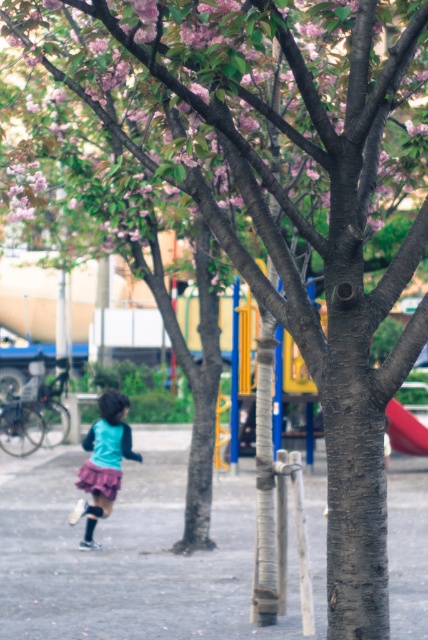
Question: Which point appears farthest from the camera in this image?

Choices:
 (A) (77, 26)
 (B) (403, 445)
 (C) (107, 464)

Answer: (B)

Question: Does pink matte flowers at upper left appear under smooth plastic slide at right?

Choices:
 (A) no
 (B) yes

Answer: (A)

Question: Which point is farther from the camera taking this photo?

Choices:
 (A) (392, 442)
 (B) (121, 392)
 (C) (336, 212)

Answer: (B)

Question: Can you confirm if matte teal shirt at center is smaller than smooth plastic slide at right?

Choices:
 (A) yes
 (B) no

Answer: (B)

Question: Among these objects, which one is farthest from the camera?

Choices:
 (A) smooth plastic slide at right
 (B) matte teal shirt at center

Answer: (A)

Question: Is matte teal shirt at center above smooth plastic slide at right?

Choices:
 (A) yes
 (B) no

Answer: (B)